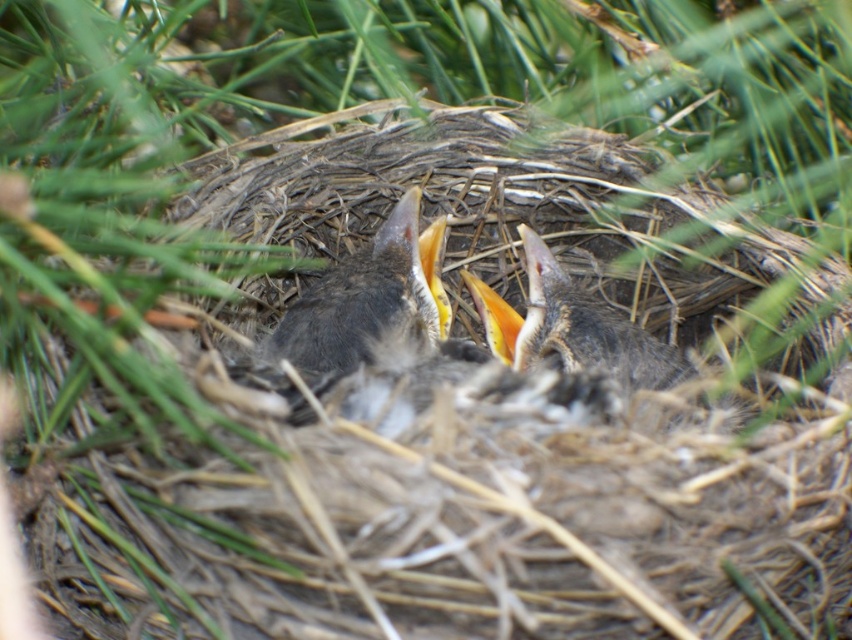
Is dark gray feathers at center behind soft gray feathers at center?

No, dark gray feathers at center is in front of soft gray feathers at center.

How distant is dark gray feathers at center from soft gray feathers at center?

They are 7.27 inches apart.

Who is more distant from viewer, (312, 301) or (611, 310)?

The point (611, 310) is behind.

Locate an element on the screen. This screenshot has height=640, width=852. dark gray feathers at center is located at coordinates (363, 310).